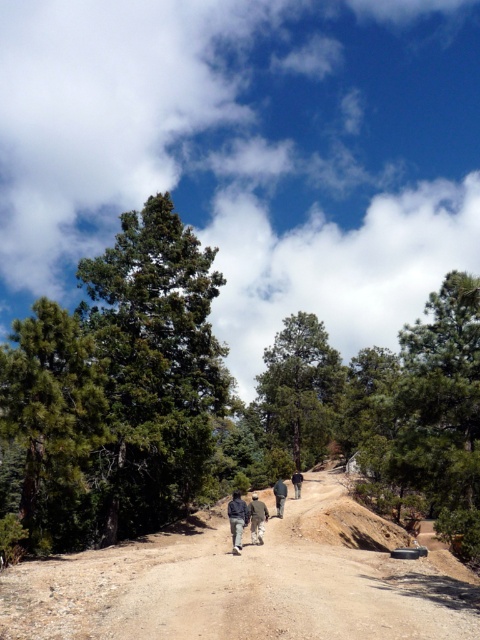
Between green matte tree at center and dark gray sweater at center, which one appears on the left side from the viewer's perspective?

From the viewer's perspective, dark gray sweater at center appears more on the left side.

This screenshot has width=480, height=640. I want to click on green matte tree at center, so click(x=300, y=387).

Measure the distance between green matte tree at center and camera.

green matte tree at center and camera are 59.15 meters apart.

I want to click on green matte tree at center, so click(x=300, y=387).

Identify the location of green textured tree at center. Image resolution: width=480 pixels, height=640 pixels. (119, 388).

Between green textured tree at center and light gray fabric pants at center, which one is positioned lower?

light gray fabric pants at center is lower down.

Does point (84, 444) lie behind point (254, 515)?

Yes, point (84, 444) is behind point (254, 515).

Identify the location of green textured tree at center. The height and width of the screenshot is (640, 480). (119, 388).

This screenshot has height=640, width=480. Describe the element at coordinates (256, 518) in the screenshot. I see `light gray fabric pants at center` at that location.

Who is more forward, [256,534] or [295,477]?

Point [256,534] is in front.

The height and width of the screenshot is (640, 480). Find the location of `light gray fabric pants at center`. light gray fabric pants at center is located at coordinates (256, 518).